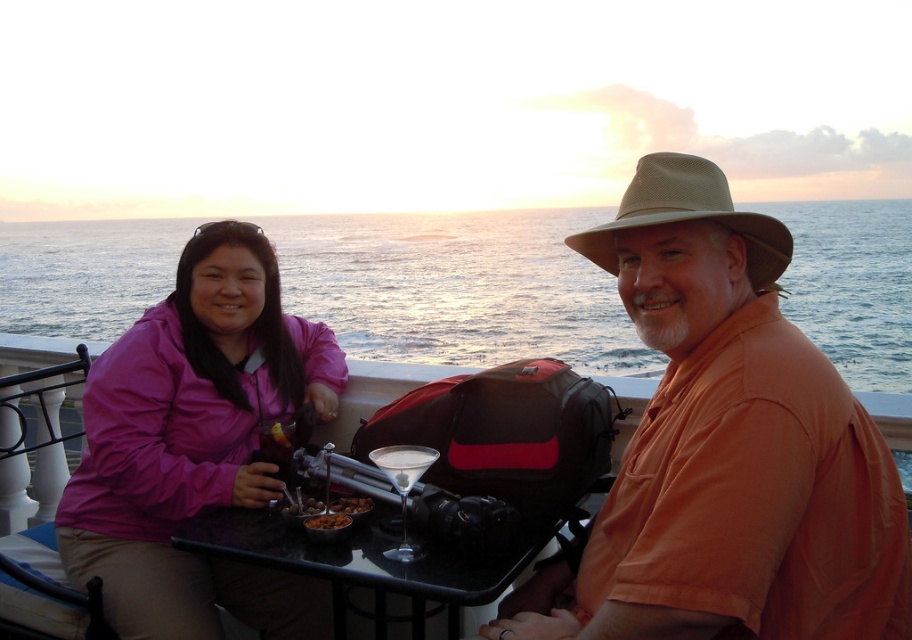
You are a photographer trying to capture the sunset with both the pink fabric jacket at left and the beige mesh cowboy hat at upper right in the frame. If you want to ensure both are fully visible, which object should you focus on first to avoid cropping either?

You should focus on the pink fabric jacket at left first because its width is larger than the beige mesh cowboy hat at upper right, so ensuring it fits properly will automatically accommodate the smaller hat in the frame.

From the picture: You are standing on the balcony and want to place a small plate on the table between the pink fabric jacket at left and the shiny metallic bowl at table center. Which object should you place it closer to to ensure it is closer to the viewer?

You should place the small plate closer to the pink fabric jacket at left because it is closer to the viewer than the shiny metallic bowl at table center.